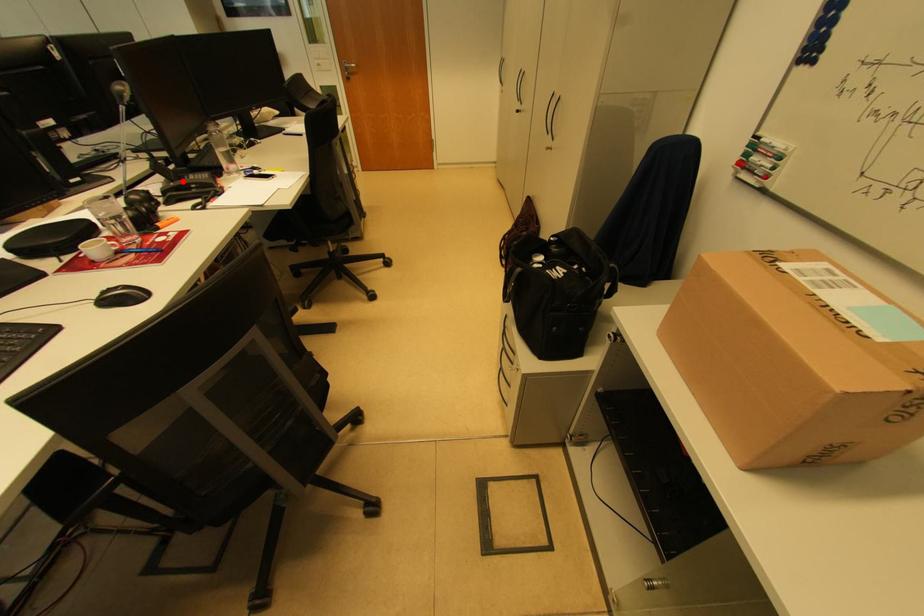
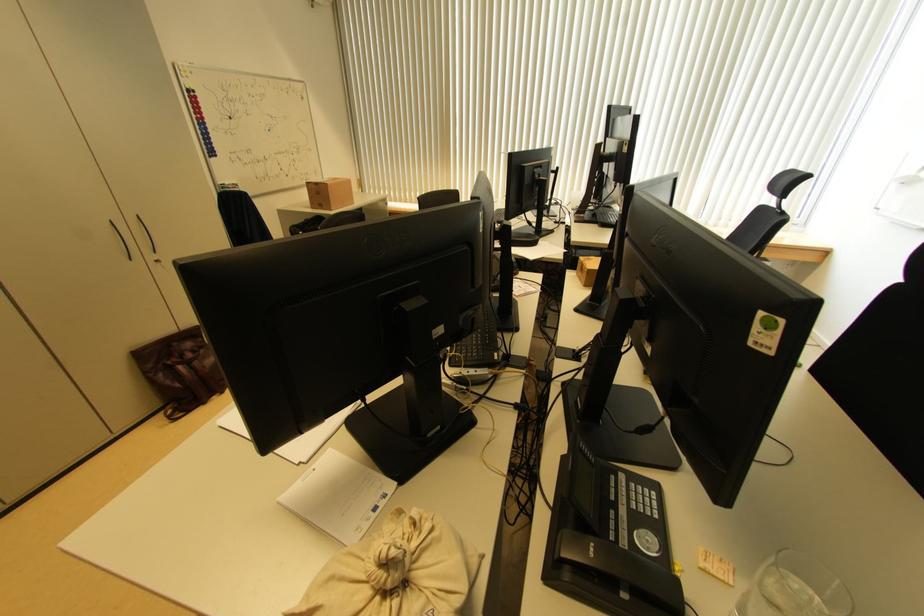
Question: I am providing you with two images of the same scene from different viewpoints. A red point is marked on the first image. Can you still see the location of the red point in image 2?

Choices:
 (A) Yes
 (B) No

Answer: (B)